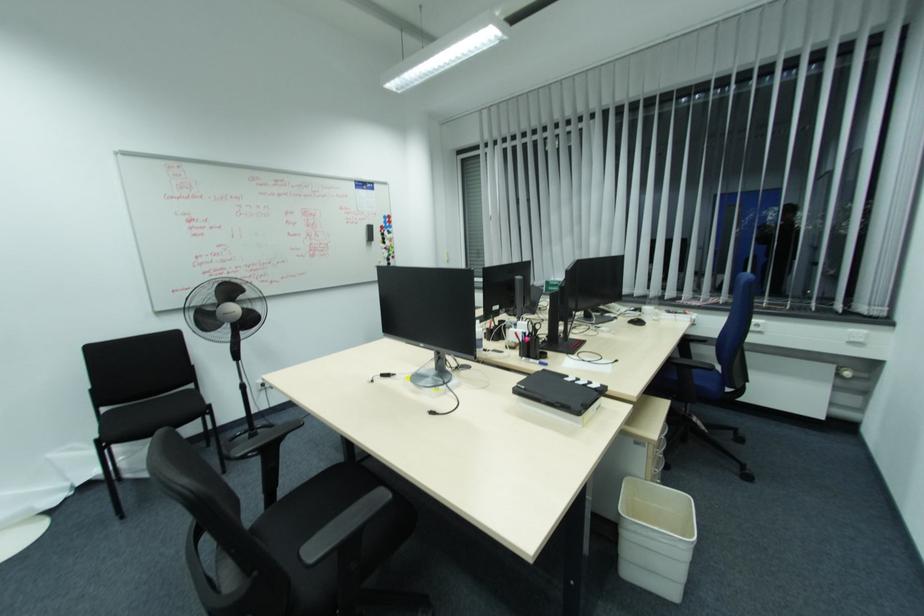
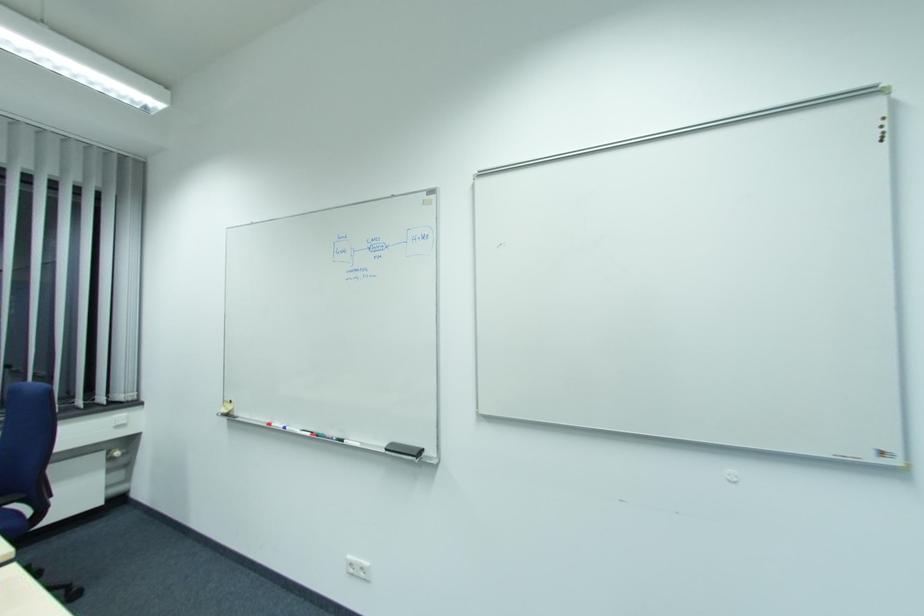
Question: How did the camera likely rotate?

Choices:
 (A) Left
 (B) Right
 (C) Up
 (D) Down

Answer: (B)